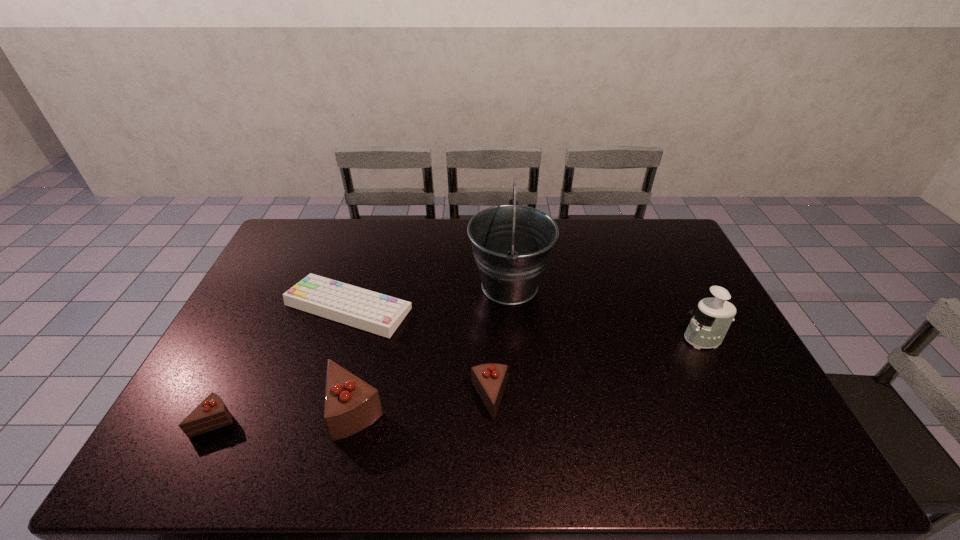
Image resolution: width=960 pixels, height=540 pixels. Find the location of `vacant space that satisfies the following two spatial constraints: 1. on the back side of the fourth shortest object; 2. on the right side of the shortest chocolate cake`. vacant space that satisfies the following two spatial constraints: 1. on the back side of the fourth shortest object; 2. on the right side of the shortest chocolate cake is located at coordinates (221, 410).

I want to click on vacant position in the image that satisfies the following two spatial constraints: 1. on the front side of the computer keyboard; 2. on the right side of the second shortest chocolate cake, so click(x=319, y=400).

Where is `free space that satisfies the following two spatial constraints: 1. on the back side of the fourth tallest object; 2. on the right side of the rightmost object`? Image resolution: width=960 pixels, height=540 pixels. free space that satisfies the following two spatial constraints: 1. on the back side of the fourth tallest object; 2. on the right side of the rightmost object is located at coordinates (489, 340).

You are a GUI agent. You are given a task and a screenshot of the screen. Output one action in this format:
    pyautogui.click(x=<x>, y=<y>)
    Task: Click on the free space that satisfies the following two spatial constraints: 1. on the back side of the leftmost chocolate cake; 2. on the left side of the second chocolate cake from left to right
    This screenshot has width=960, height=540.
    Given the screenshot: What is the action you would take?
    pyautogui.click(x=221, y=410)